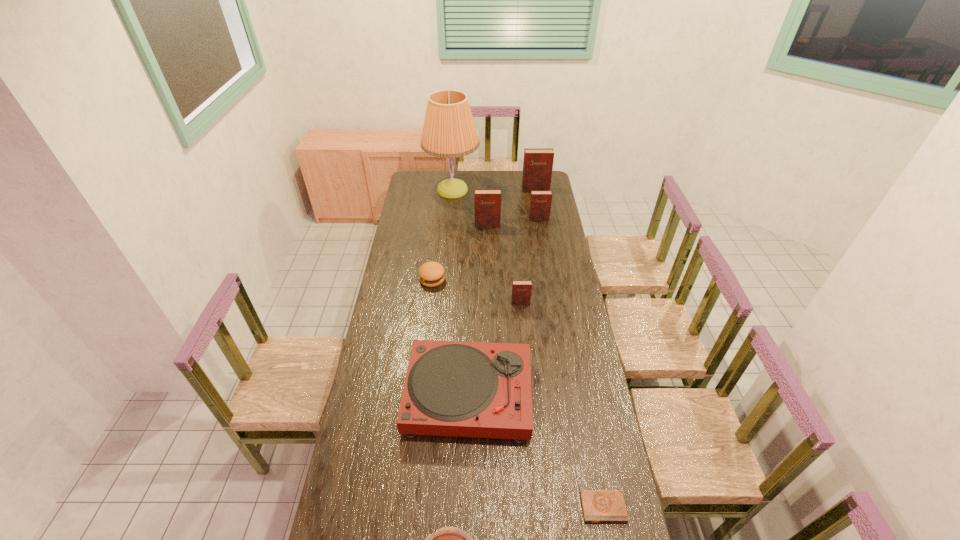
You are a GUI agent. You are given a task and a screenshot of the screen. Output one action in this format:
    pyautogui.click(x=<x>, y=<y>)
    Task: Click on the tallest object
    This screenshot has width=960, height=540.
    Given the screenshot: What is the action you would take?
    pyautogui.click(x=449, y=131)

I want to click on lamp, so click(x=449, y=131).

Identify the location of the tallest diary. The width and height of the screenshot is (960, 540). (538, 162).

This screenshot has width=960, height=540. Identify the location of the farthest reddish-brown diary. (538, 162).

The width and height of the screenshot is (960, 540). I want to click on the third smallest reddish-brown diary, so click(x=487, y=202).

Identify the location of the third farthest diary. Image resolution: width=960 pixels, height=540 pixels. (487, 202).

The height and width of the screenshot is (540, 960). I want to click on the third farthest object, so click(540, 202).

Locate an element on the screen. the third biggest reddish-brown diary is located at coordinates (540, 202).

I want to click on the second reddish-brown diary from left to right, so click(x=521, y=289).

I want to click on the second nearest diary, so click(x=521, y=289).